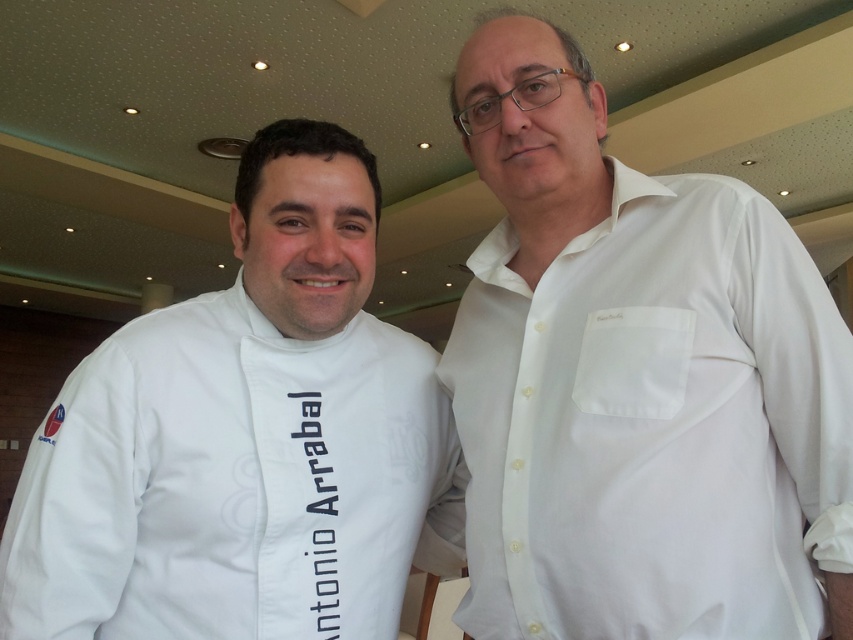
Question: Is white cotton shirt at right smaller than white fabric chef coat at left?

Choices:
 (A) yes
 (B) no

Answer: (A)

Question: Among these objects, which one is nearest to the camera?

Choices:
 (A) white fabric chef coat at left
 (B) white cotton shirt at right

Answer: (B)

Question: Can you confirm if white cotton shirt at right is bigger than white fabric chef coat at left?

Choices:
 (A) no
 (B) yes

Answer: (A)

Question: Is white cotton shirt at right wider than white fabric chef coat at left?

Choices:
 (A) no
 (B) yes

Answer: (A)